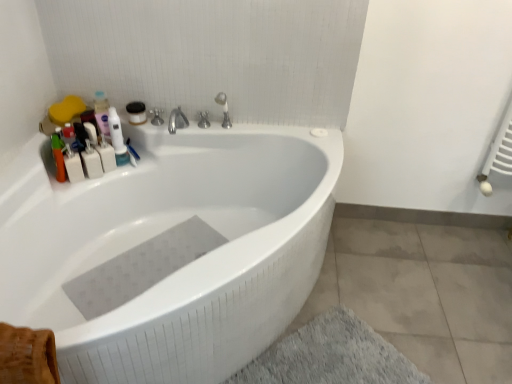
This screenshot has height=384, width=512. Identify the location of free location to the right of satin nickel faucet at upper center, the first tap from the right. (x=260, y=128).